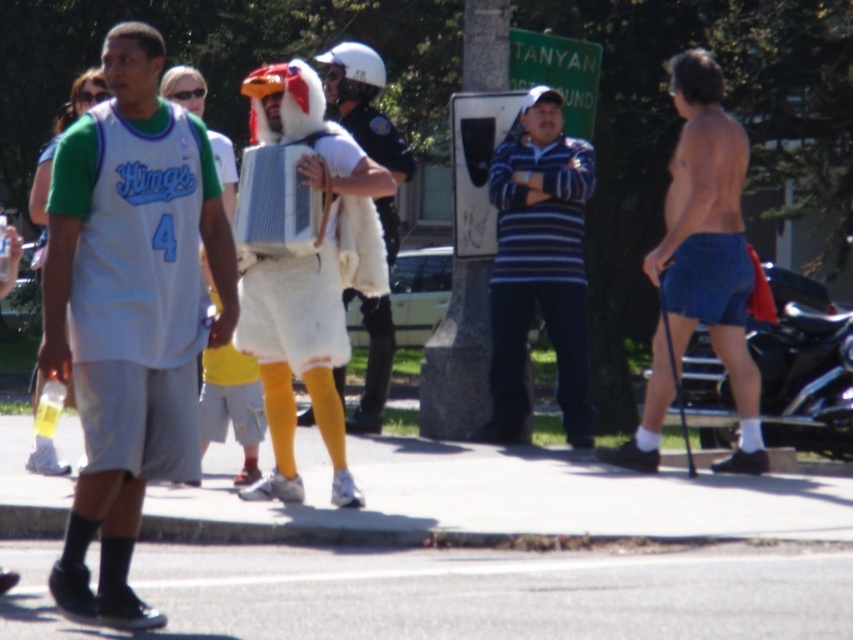
Based on the photo, you are standing in the lively street scene and want to walk from the chicken performer to the basketball jersey wearer. Which point should you step on first, point (108,348) or point (643,429)?

You should step on point (108,348) first because it is in front of point (643,429).

Consider the image. You are a photographer trying to capture the scene. You want to ensure that both the denim shorts at right and the fuzzy white costume at center are in the frame. Based on their positions, which object should you focus on first to include both in your shot?

The denim shorts at right is positioned on the right side of the fuzzy white costume at center. To include both in the frame, you should focus on the fuzzy white costume at center first, as it is centrally located and the denim shorts at right is to its right side.

You are a photographer trying to capture both the denim shorts at right and the fuzzy white costume at center in the same frame. Which object should you focus on first to ensure both are in focus?

The denim shorts at right is shorter than the fuzzy white costume at center, so you should focus on the fuzzy white costume at center first to ensure both are in focus.